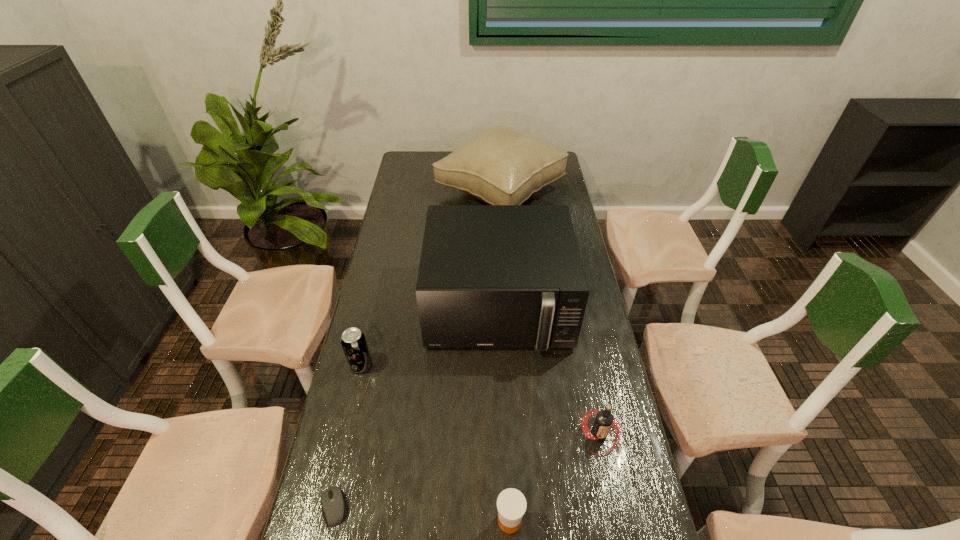
Identify the location of object that can be found as the third closest to the medicine. Image resolution: width=960 pixels, height=540 pixels. (490, 276).

The height and width of the screenshot is (540, 960). In order to click on vacant area in the image that satisfies the following two spatial constraints: 1. on the back side of the soda can; 2. on the left side of the cushion in this screenshot , I will do `click(400, 192)`.

This screenshot has width=960, height=540. What are the coordinates of `vacant region that satisfies the following two spatial constraints: 1. on the front side of the soda can; 2. on the right side of the shortest object` in the screenshot? It's located at (327, 507).

I want to click on free space that satisfies the following two spatial constraints: 1. on the back side of the computer equipment; 2. on the left side of the cushion, so (x=404, y=192).

In order to click on free space that satisfies the following two spatial constraints: 1. on the label of the third nearest object; 2. on the label of the medicine in this screenshot , I will do `click(617, 521)`.

The image size is (960, 540). Identify the location of vacant point that satisfies the following two spatial constraints: 1. on the label of the root beer; 2. on the label of the medicine. (617, 521).